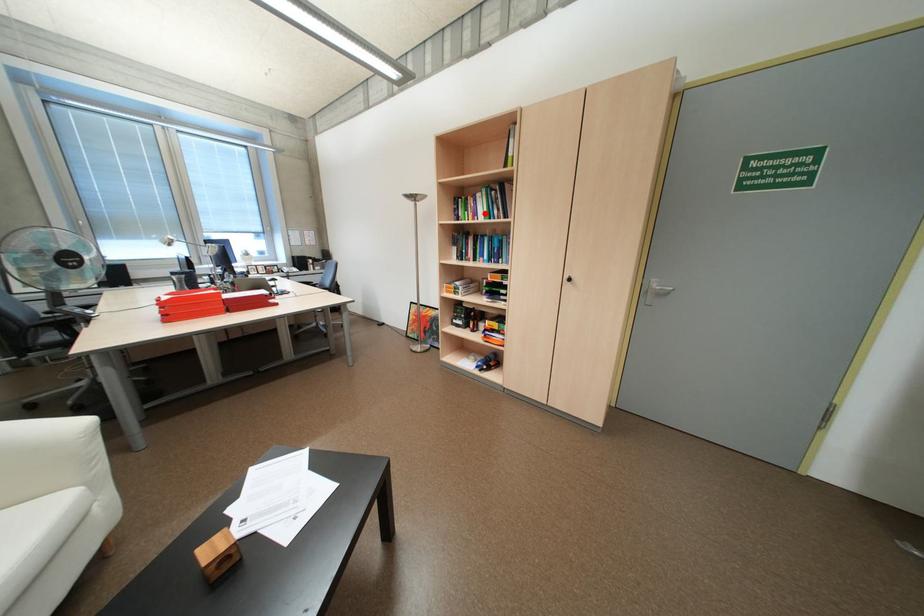
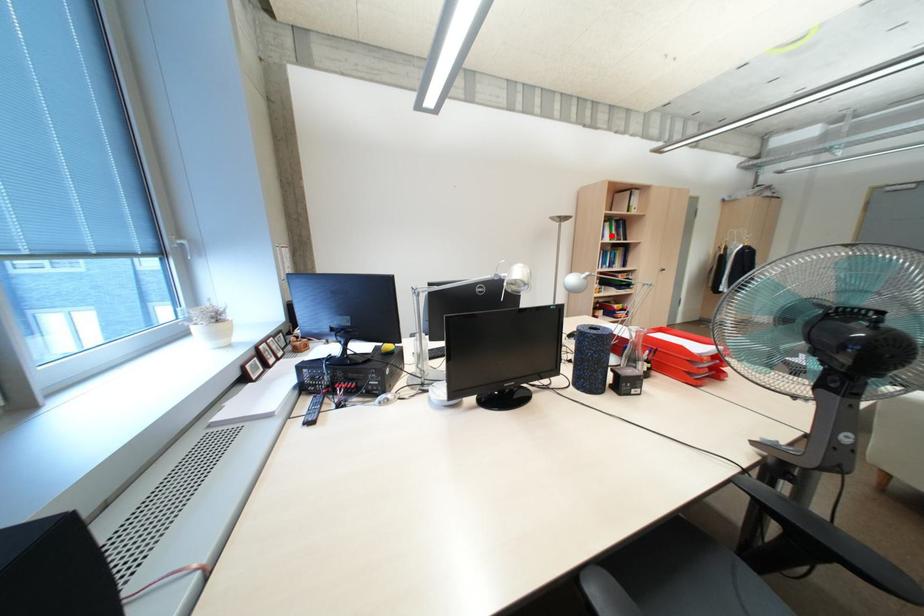
I am providing you with two images of the same scene from different viewpoints. A red point is marked on the first image and another point is marked on the second image. Do the highlighted points in image1 and image2 indicate the same real-world spot?

Yes